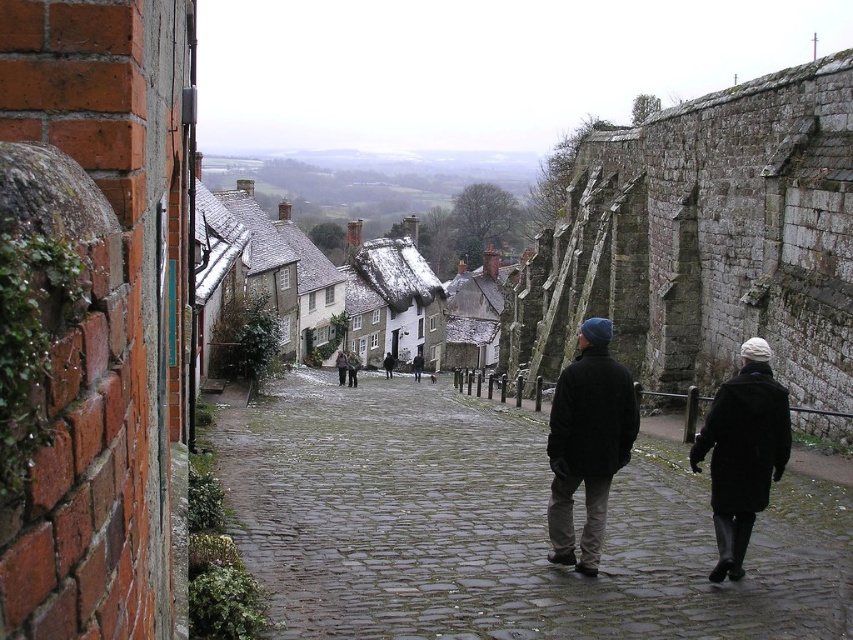
Between black wool coat at center and black wool coat at lower right, which one appears on the right side from the viewer's perspective?

black wool coat at lower right is more to the right.

Does black wool coat at center appear on the left side of black wool coat at lower right?

Correct, you'll find black wool coat at center to the left of black wool coat at lower right.

Identify the location of black wool coat at center. (587, 442).

Does wet cobblestone alley at center appear on the left side of black wool coat at center?

Correct, you'll find wet cobblestone alley at center to the left of black wool coat at center.

Is wet cobblestone alley at center smaller than black wool coat at center?

No, wet cobblestone alley at center is not smaller than black wool coat at center.

Between point (540, 516) and point (589, 332), which one is positioned behind?

The point (540, 516) is more distant.

Image resolution: width=853 pixels, height=640 pixels. I want to click on wet cobblestone alley at center, so click(x=498, y=529).

Who is positioned more to the right, black wool coat at center or brown leather jacket at center?

Positioned to the right is black wool coat at center.

Is black wool coat at center to the right of brown leather jacket at center from the viewer's perspective?

Correct, you'll find black wool coat at center to the right of brown leather jacket at center.

Does point (601, 497) come closer to viewer compared to point (352, 378)?

Yes, point (601, 497) is closer to viewer.

Where is `black wool coat at center`? black wool coat at center is located at coordinates (587, 442).